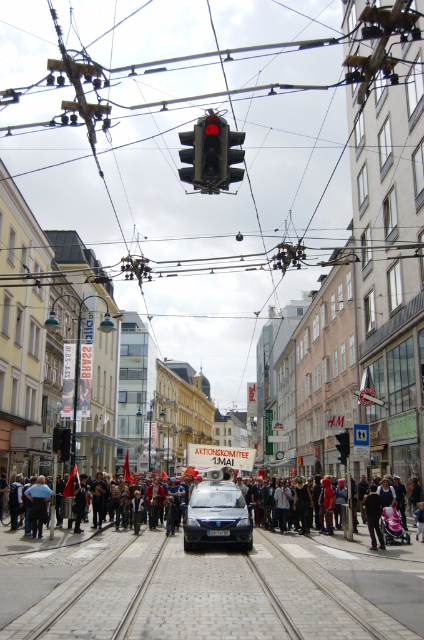
Question: Considering the relative positions of black fabric crowd at center and black glass traffic light at center in the image provided, where is black fabric crowd at center located with respect to black glass traffic light at center?

Choices:
 (A) left
 (B) right

Answer: (A)

Question: Which object is the farthest from the black glass traffic light at upper center?

Choices:
 (A) black plastic traffic light at upper center
 (B) black glass traffic light at center

Answer: (B)

Question: Considering the real-world distances, which object is closest to the white matte van at center?

Choices:
 (A) dark blue jeans at center
 (B) black fabric crowd at center

Answer: (B)

Question: Does black plastic traffic light at upper center appear on the left side of black glass traffic light at center?

Choices:
 (A) no
 (B) yes

Answer: (B)

Question: Which point is farther to the camera?

Choices:
 (A) (345, 448)
 (B) (33, 500)
 (C) (55, 444)

Answer: (A)

Question: Can you confirm if dark blue jeans at center is thinner than black glass traffic light at center?

Choices:
 (A) yes
 (B) no

Answer: (A)